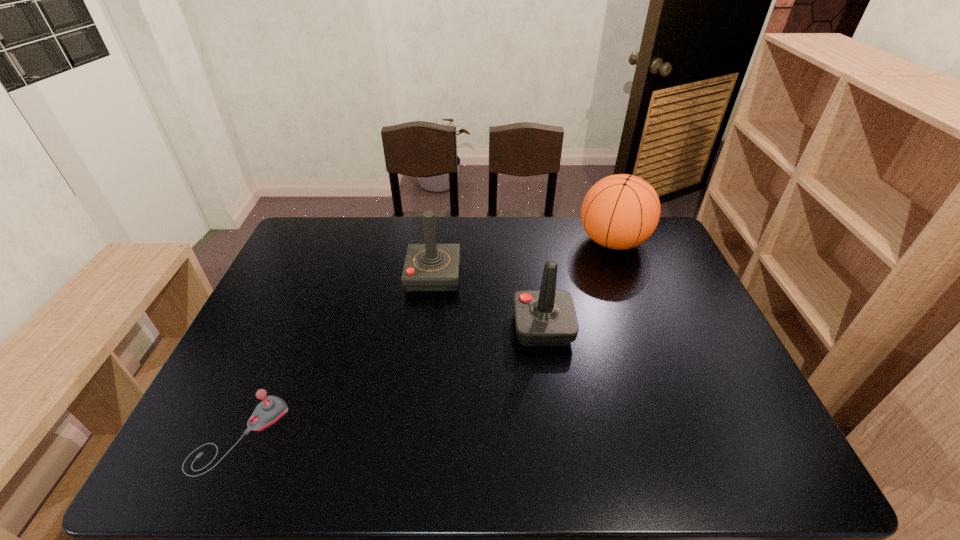
Find the location of `basketball`. basketball is located at coordinates (621, 211).

Find the location of `the farthest joystick`. the farthest joystick is located at coordinates (430, 267).

I want to click on the second joystick from right to left, so click(x=430, y=267).

I want to click on the rightmost joystick, so click(546, 317).

Where is `the second nearest joystick`? The height and width of the screenshot is (540, 960). the second nearest joystick is located at coordinates (546, 317).

Where is `the leftmost joystick`? the leftmost joystick is located at coordinates (272, 408).

Where is `the nearest joystick`? Image resolution: width=960 pixels, height=540 pixels. the nearest joystick is located at coordinates (272, 408).

Find the location of `vacant space located on the front of the basketball`. vacant space located on the front of the basketball is located at coordinates (654, 348).

The width and height of the screenshot is (960, 540). Identify the location of vacant space located 0.400m on the rectangular base of the second joystick from right to left. (587, 275).

Where is `free space located on the right of the second object from right to left`? This screenshot has width=960, height=540. free space located on the right of the second object from right to left is located at coordinates (601, 328).